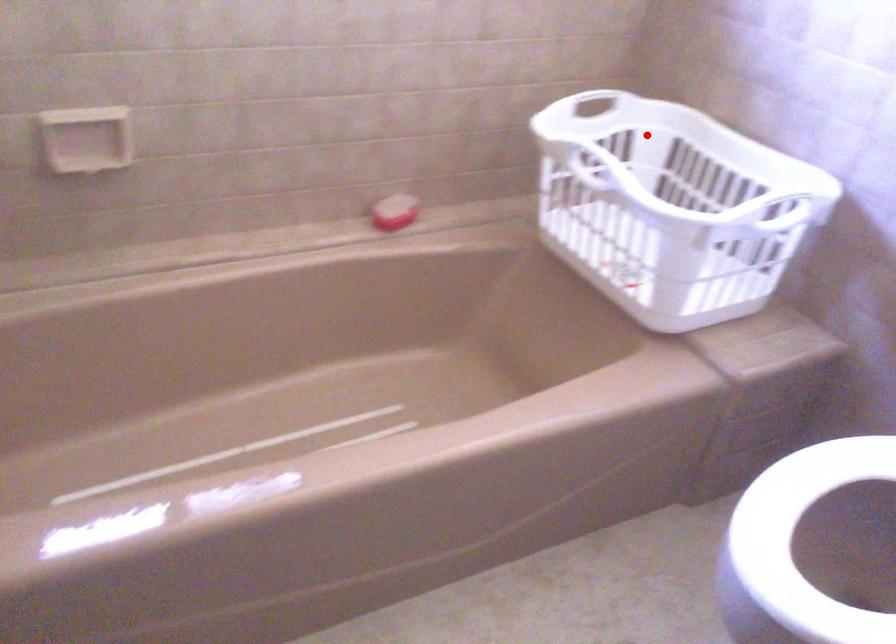
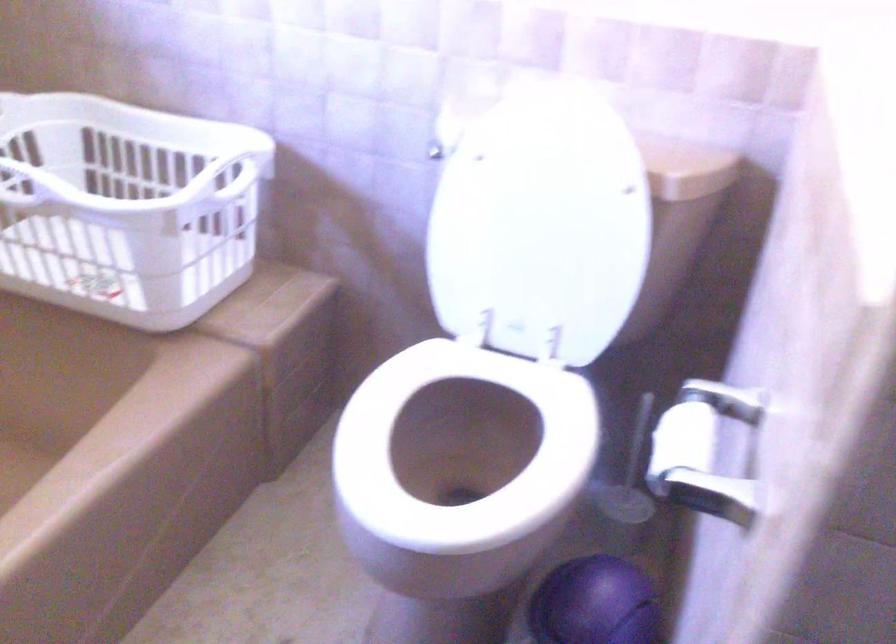
Question: I am providing you with two images of the same scene from different viewpoints. Given a red point in image1, look at the same physical point in image2. Is it:

Choices:
 (A) Closer to the viewpoint
 (B) Farther from the viewpoint

Answer: (A)